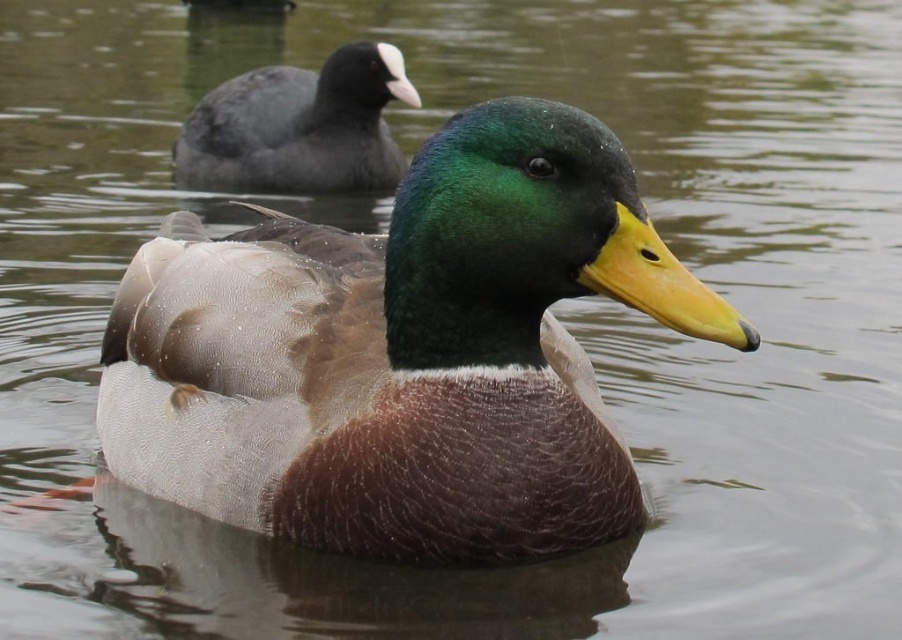
You are a birdwatcher observing the scene. You notice the green glossy duck at center and the matte gray duck at upper left. Which duck is closer to you?

The green glossy duck at center is closer to you because it is in front of the matte gray duck at upper left.

You are observing a group of ducks on a pond. You notice a green glossy duck at center and a matte gray duck at upper left. Which duck is positioned lower in the image?

The green glossy duck at center is positioned lower than the matte gray duck at upper left.